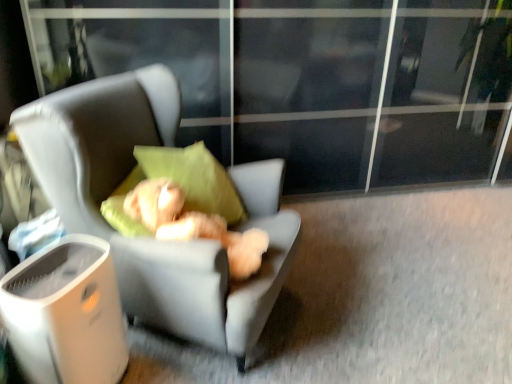
Question: From the image's perspective, relative to fluffy beige teddy bear at center, is soft gray fabric chair at center above or below?

Choices:
 (A) below
 (B) above

Answer: (B)

Question: Looking at their shapes, would you say soft gray fabric chair at center is wider or thinner than fluffy beige teddy bear at center?

Choices:
 (A) thin
 (B) wide

Answer: (B)

Question: Estimate the real-world distances between objects in this image. Which object is closer to the soft gray fabric chair at center?

Choices:
 (A) white plastic trash bin at lower left
 (B) transparent glass screen door at upper center
 (C) fluffy beige teddy bear at center

Answer: (C)

Question: Which of these objects is positioned closest to the transparent glass screen door at upper center?

Choices:
 (A) white plastic trash bin at lower left
 (B) fluffy beige teddy bear at center
 (C) soft gray fabric chair at center

Answer: (C)